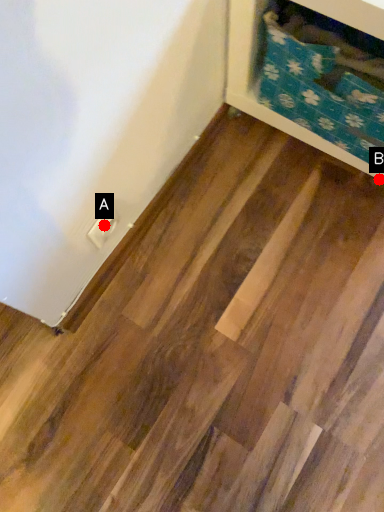
Question: Two points are circled on the image, labeled by A and B beside each circle. Which point is closer to the camera?

Choices:
 (A) A is closer
 (B) B is closer

Answer: (A)